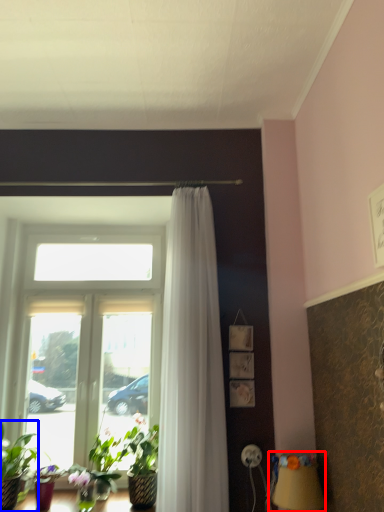
Question: Which object is further to the camera taking this photo, table lamp (highlighted by a red box) or houseplant (highlighted by a blue box)?

Choices:
 (A) table lamp
 (B) houseplant

Answer: (B)